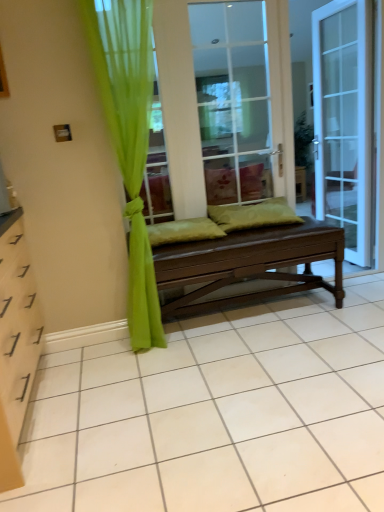
Question: Is green fabric pillow at center, the second pillow viewed from the right, a part of green sheer curtain at left?

Choices:
 (A) yes
 (B) no

Answer: (B)

Question: From a real-world perspective, is green sheer curtain at left on green fabric pillow at center, which is the first pillow in left-to-right order?

Choices:
 (A) no
 (B) yes

Answer: (B)

Question: From the image's perspective, does green sheer curtain at left appear lower than green fabric pillow at center, the second pillow viewed from the right?

Choices:
 (A) yes
 (B) no

Answer: (B)

Question: Does green sheer curtain at left come behind green fabric pillow at center, the second pillow viewed from the right?

Choices:
 (A) no
 (B) yes

Answer: (A)

Question: Is green sheer curtain at left to the left of green fabric pillow at center, the second pillow viewed from the right, from the viewer's perspective?

Choices:
 (A) no
 (B) yes

Answer: (B)

Question: From a real-world perspective, is matte brown bench at center physically located above or below green fabric pillow at center, the second pillow viewed from the right?

Choices:
 (A) below
 (B) above

Answer: (A)

Question: Is matte brown bench at center spatially inside green fabric pillow at center, which is the first pillow in left-to-right order, or outside of it?

Choices:
 (A) outside
 (B) inside

Answer: (A)

Question: Looking at the image, does matte brown bench at center seem bigger or smaller compared to green fabric pillow at center, which is the first pillow in left-to-right order?

Choices:
 (A) small
 (B) big

Answer: (B)

Question: Considering their positions, is matte brown bench at center located in front of or behind green fabric pillow at center, which is the first pillow in left-to-right order?

Choices:
 (A) behind
 (B) front

Answer: (B)

Question: Is green fabric pillow at center, the second pillow viewed from the right, wider or thinner than green sheer curtain at left?

Choices:
 (A) wide
 (B) thin

Answer: (A)

Question: From a real-world perspective, is green fabric pillow at center, which is the first pillow in left-to-right order, above or below green sheer curtain at left?

Choices:
 (A) below
 (B) above

Answer: (A)

Question: Is green fabric pillow at center, the second pillow viewed from the right, to the left or to the right of green sheer curtain at left in the image?

Choices:
 (A) right
 (B) left

Answer: (A)

Question: From the image's perspective, is green fabric pillow at center, the second pillow viewed from the right, above or below green sheer curtain at left?

Choices:
 (A) above
 (B) below

Answer: (B)

Question: From a real-world perspective, is brown wooden bench at center above or below green sheer curtain at left?

Choices:
 (A) above
 (B) below

Answer: (A)

Question: Considering the positions of brown wooden bench at center and green sheer curtain at left in the image, is brown wooden bench at center bigger or smaller than green sheer curtain at left?

Choices:
 (A) big
 (B) small

Answer: (B)